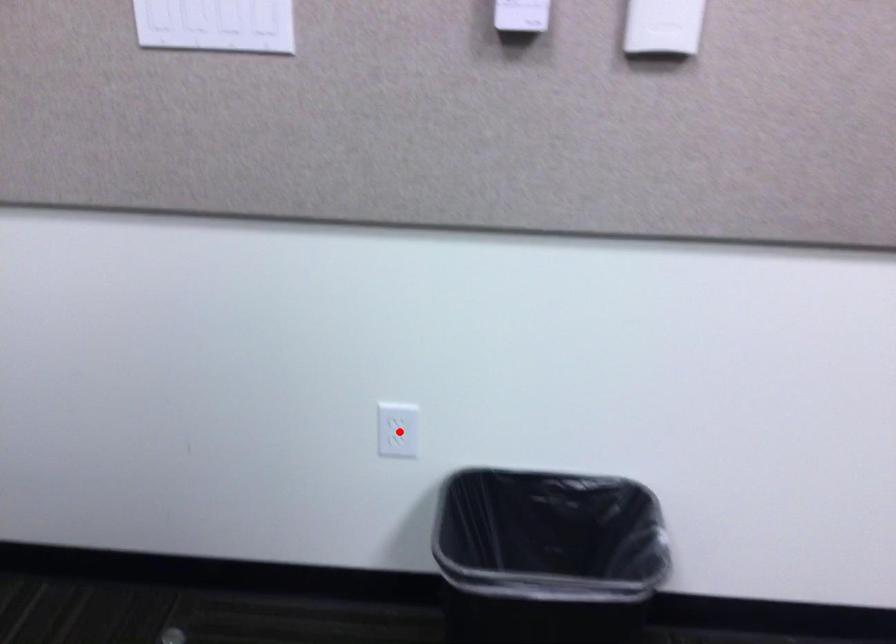
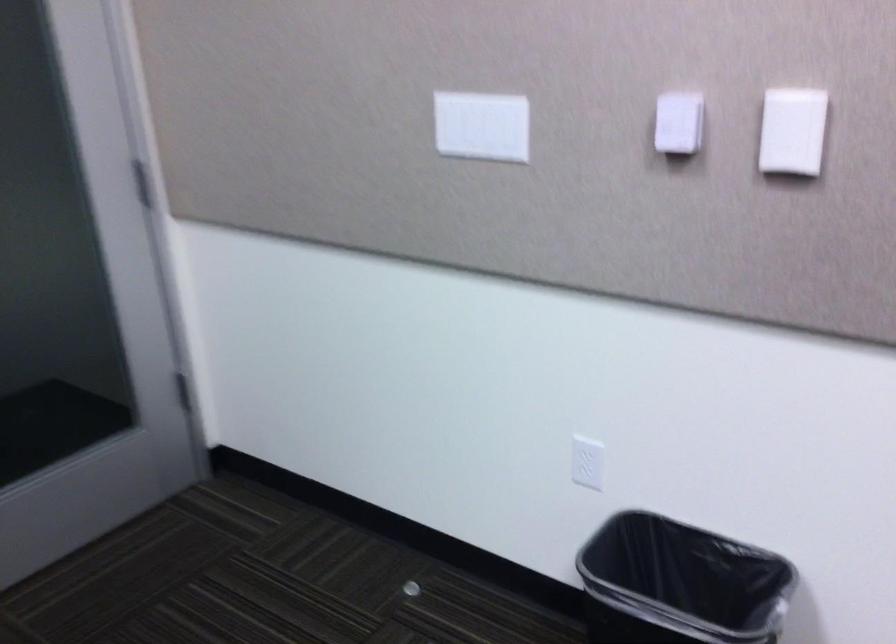
Question: I am providing you with two images of the same scene from different viewpoints. A red point is shown in image1. For the corresponding object point in image2, is it positioned nearer or farther from the camera?

Choices:
 (A) Nearer
 (B) Farther

Answer: (B)